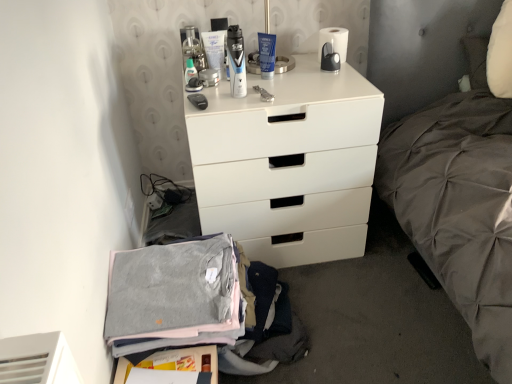
Question: Should I look upward or downward to see translucent plastic bottle at upper center?

Choices:
 (A) up
 (B) down

Answer: (A)

Question: Can you confirm if translucent plastic bottle at upper center is wider than gray cotton sweater at lower left?

Choices:
 (A) yes
 (B) no

Answer: (B)

Question: Is translucent plastic bottle at upper center positioned before gray cotton sweater at lower left?

Choices:
 (A) yes
 (B) no

Answer: (B)

Question: From the image's perspective, would you say translucent plastic bottle at upper center is positioned over gray cotton sweater at lower left?

Choices:
 (A) yes
 (B) no

Answer: (A)

Question: From a real-world perspective, does translucent plastic bottle at upper center stand above gray cotton sweater at lower left?

Choices:
 (A) yes
 (B) no

Answer: (A)

Question: From the image's perspective, is translucent plastic bottle at upper center below gray cotton sweater at lower left?

Choices:
 (A) no
 (B) yes

Answer: (A)

Question: Considering the relative sizes of translucent plastic bottle at upper center and gray cotton sweater at lower left in the image provided, is translucent plastic bottle at upper center thinner than gray cotton sweater at lower left?

Choices:
 (A) yes
 (B) no

Answer: (A)

Question: Is white matte chest of drawers at center not close to gray cotton sweater at lower left?

Choices:
 (A) yes
 (B) no

Answer: (B)

Question: Considering the relative sizes of white matte chest of drawers at center and gray cotton sweater at lower left in the image provided, is white matte chest of drawers at center shorter than gray cotton sweater at lower left?

Choices:
 (A) no
 (B) yes

Answer: (A)

Question: From the image's perspective, is white matte chest of drawers at center below gray cotton sweater at lower left?

Choices:
 (A) no
 (B) yes

Answer: (A)

Question: Would you say white matte chest of drawers at center is outside gray cotton sweater at lower left?

Choices:
 (A) yes
 (B) no

Answer: (A)

Question: From the image's perspective, is white matte chest of drawers at center above gray cotton sweater at lower left?

Choices:
 (A) yes
 (B) no

Answer: (A)

Question: Is white matte chest of drawers at center surrounding gray cotton sweater at lower left?

Choices:
 (A) yes
 (B) no

Answer: (B)

Question: Is white matte chest of drawers at center surrounded by translucent plastic bottle at upper center?

Choices:
 (A) no
 (B) yes

Answer: (A)